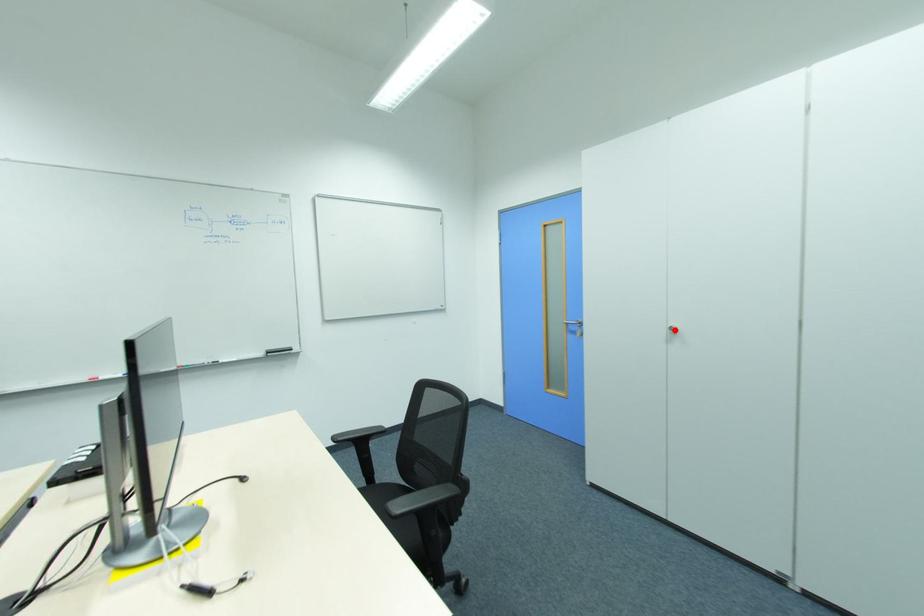
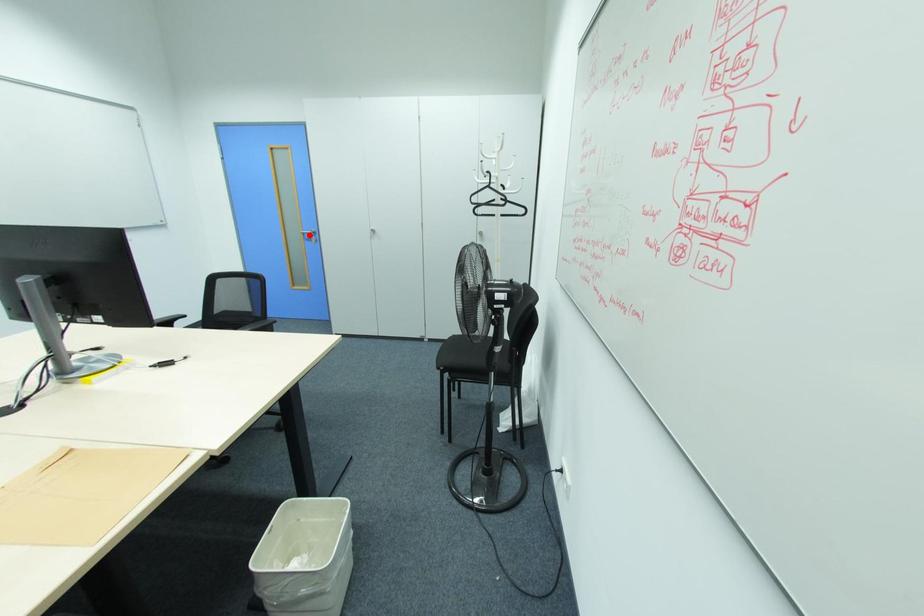
I am providing you with two images of the same scene from different viewpoints. A red point is marked on the first image and another point is marked on the second image. Are the points marked in image1 and image2 representing the same 3D position?

No